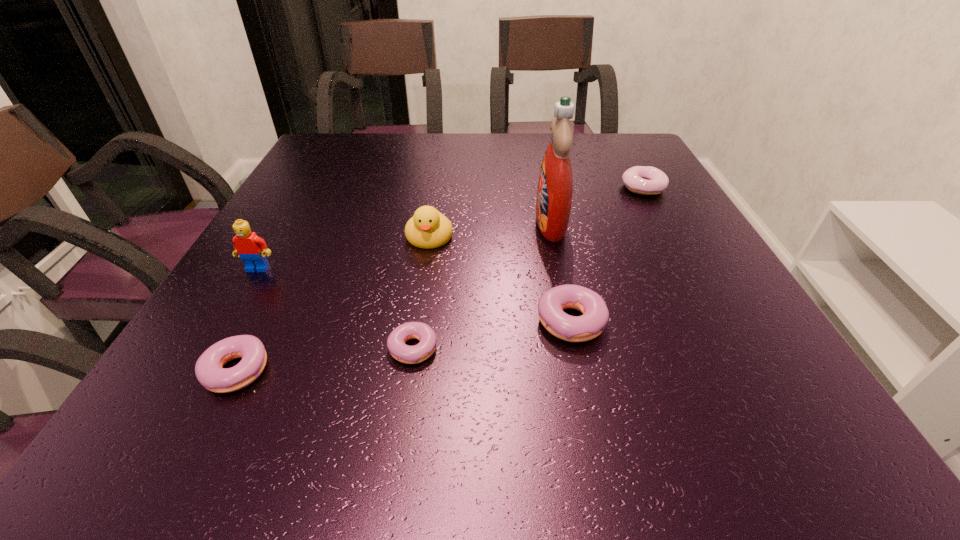
Locate which object ranks fifth in proximity to the fifth shortest object. Please provide its 2D coordinates. Your answer should be formatted as a tuple, i.e. [(x, y)], where the tuple contains the x and y coordinates of a point satisfying the conditions above.

[(208, 369)]

This screenshot has height=540, width=960. Find the location of `object that is the fourth nearest to the sixth tallest object`. object that is the fourth nearest to the sixth tallest object is located at coordinates (591, 324).

Choose which doughnut is the second nearest neighbor to the farthest doughnut. Please provide its 2D coordinates. Your answer should be formatted as a tuple, i.e. [(x, y)], where the tuple contains the x and y coordinates of a point satisfying the conditions above.

[(424, 333)]

Identify which doughnut is located as the nearest to the fifth shortest object. Please provide its 2D coordinates. Your answer should be formatted as a tuple, i.e. [(x, y)], where the tuple contains the x and y coordinates of a point satisfying the conditions above.

[(424, 333)]

Find the location of a particular element. The height and width of the screenshot is (540, 960). blank area in the image that satisfies the following two spatial constraints: 1. on the face of the second doughnut from right to left; 2. on the right side of the duckling is located at coordinates (418, 320).

You are a GUI agent. You are given a task and a screenshot of the screen. Output one action in this format:
    pyautogui.click(x=<x>, y=<y>)
    Task: Click on the vacant area that satisfies the following two spatial constraints: 1. on the front surface of the tallest object; 2. on the face of the third tallest object
    The height and width of the screenshot is (540, 960).
    Given the screenshot: What is the action you would take?
    pyautogui.click(x=553, y=237)

The height and width of the screenshot is (540, 960). Find the location of `free point that satisfies the following two spatial constraints: 1. on the front surface of the tallest object; 2. on the face of the sixth shortest object`. free point that satisfies the following two spatial constraints: 1. on the front surface of the tallest object; 2. on the face of the sixth shortest object is located at coordinates (560, 268).

In order to click on blank area in the image that satisfies the following two spatial constraints: 1. on the face of the duckling; 2. on the left side of the second doughnut from right to left in this screenshot , I will do `click(418, 320)`.